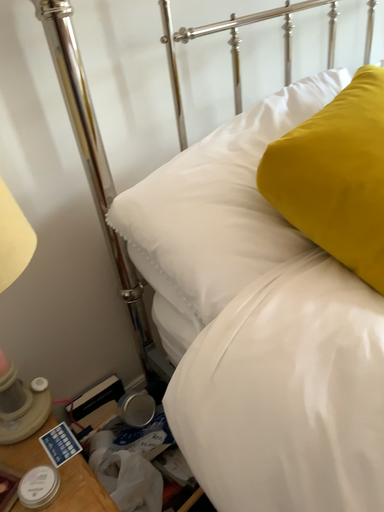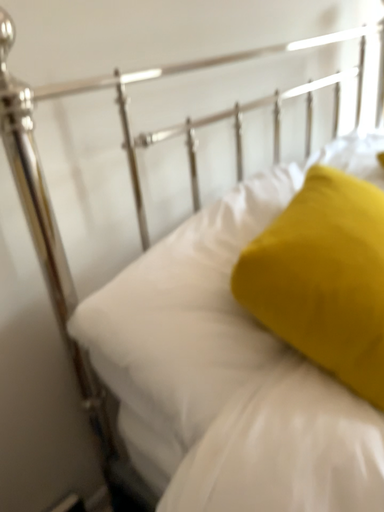
Question: How did the camera likely rotate when shooting the video?

Choices:
 (A) rotated left
 (B) rotated right

Answer: (B)